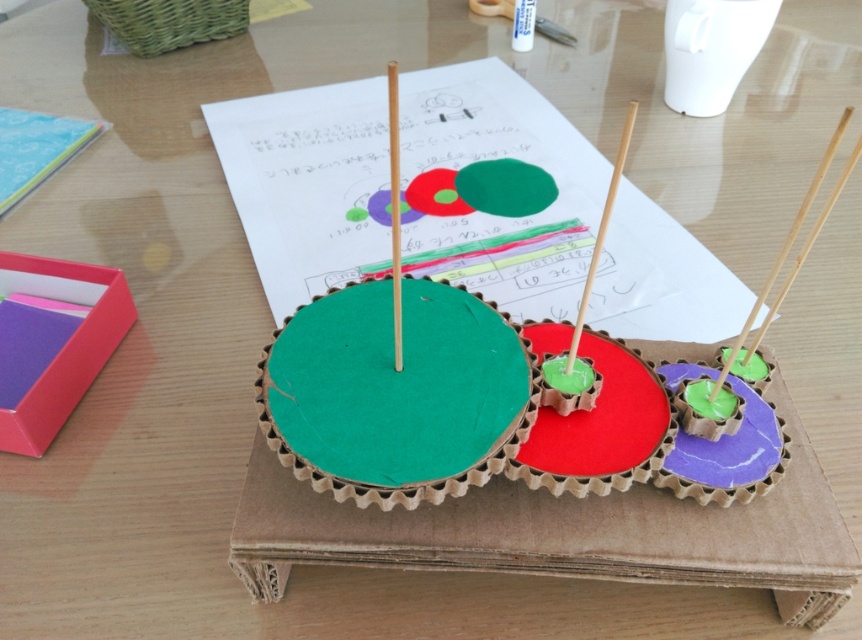
You are arranging a craft project on a table and need to place the green cardboard circle at center and the smooth wood toothpick at center. According to the image, which object is positioned to the right?

The smooth wood toothpick at center is positioned to the right of the green cardboard circle at center.

You are an artist planning to place a new decorative element on the wooden table where the craft project is displayed. You want to position it precisely at the coordinates given for the green cardboard circle at center. What is the exact 2D coordinate where you should place your new element?

The exact 2D coordinate for the green cardboard circle at center is point (x=395, y=392).

You are an artist working on this craft project. You want to remove the wooden stick at center without moving the green cardboard circle at center. Is this possible?

The wooden stick at center is behind the green cardboard circle at center, so removing the wooden stick at center would require moving the green cardboard circle at center as well.